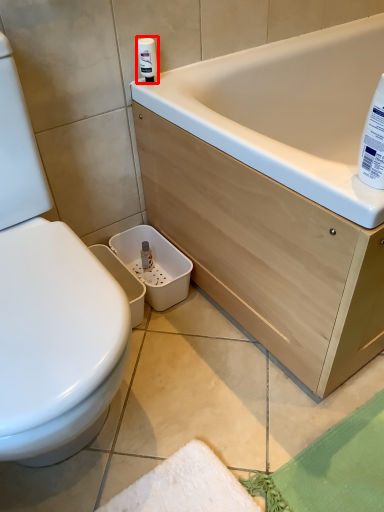
Question: From the image's perspective, considering the relative positions of cleaning product (annotated by the red box) and cleaning product in the image provided, where is cleaning product (annotated by the red box) located with respect to the staircase?

Choices:
 (A) above
 (B) below

Answer: (A)